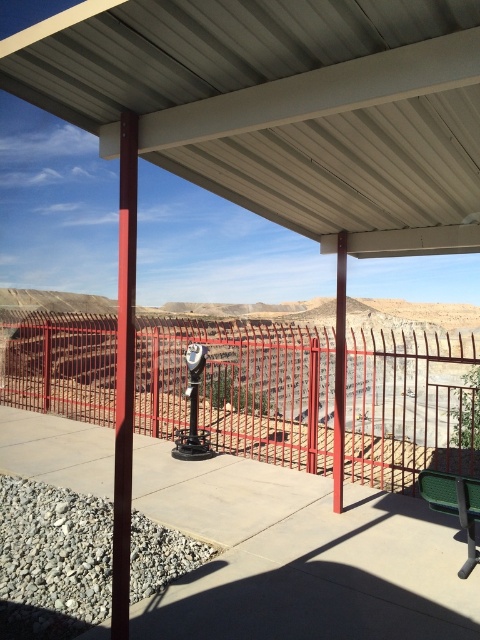
Does metallic gray canopy at upper center have a lesser width compared to smooth red pole at center?

In fact, metallic gray canopy at upper center might be wider than smooth red pole at center.

Measure the distance from metallic gray canopy at upper center to smooth red pole at center.

metallic gray canopy at upper center and smooth red pole at center are 1.40 meters apart.

Locate an element on the screen. This screenshot has height=640, width=480. metallic gray canopy at upper center is located at coordinates (283, 106).

Who is positioned more to the left, red metal fence at center or smooth red pole at center?

From the viewer's perspective, smooth red pole at center appears more on the left side.

Who is positioned more to the right, red metal fence at center or smooth red pole at center?

→ Positioned to the right is red metal fence at center.

Measure the distance between point (x=310, y=339) and camera.

6.39 meters

Find the location of a particular element. red metal fence at center is located at coordinates (240, 388).

Can you confirm if smooth red pole at center is positioned to the left of green plastic bench at lower right?

Correct, you'll find smooth red pole at center to the left of green plastic bench at lower right.

Who is more forward, (133, 168) or (472, 564)?

→ Point (133, 168)

Find the location of a particular element. This screenshot has width=480, height=640. smooth red pole at center is located at coordinates (124, 372).